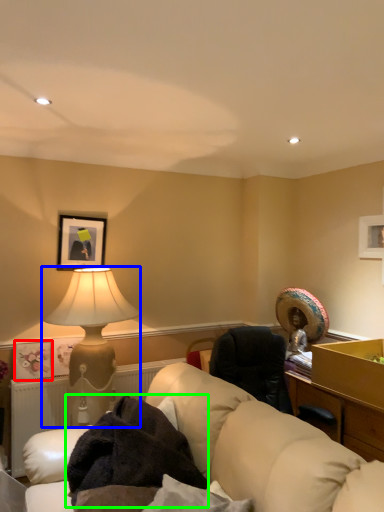
Question: Estimate the real-world distances between objects in this image. Which object is farther from picture frame (highlighted by a red box), lamp (highlighted by a blue box) or blanket (highlighted by a green box)?

Choices:
 (A) lamp
 (B) blanket

Answer: (B)